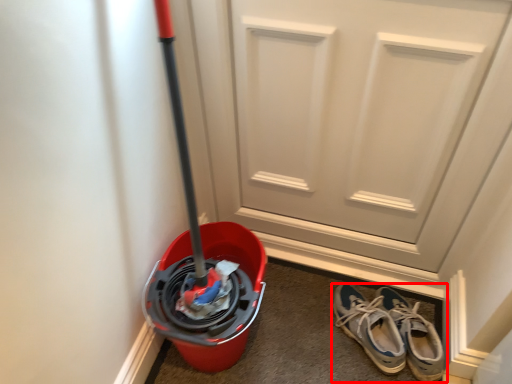
Question: From the image's perspective, considering the relative positions of footwear (annotated by the red box) and door in the image provided, where is footwear (annotated by the red box) located with respect to the staircase?

Choices:
 (A) above
 (B) below

Answer: (B)